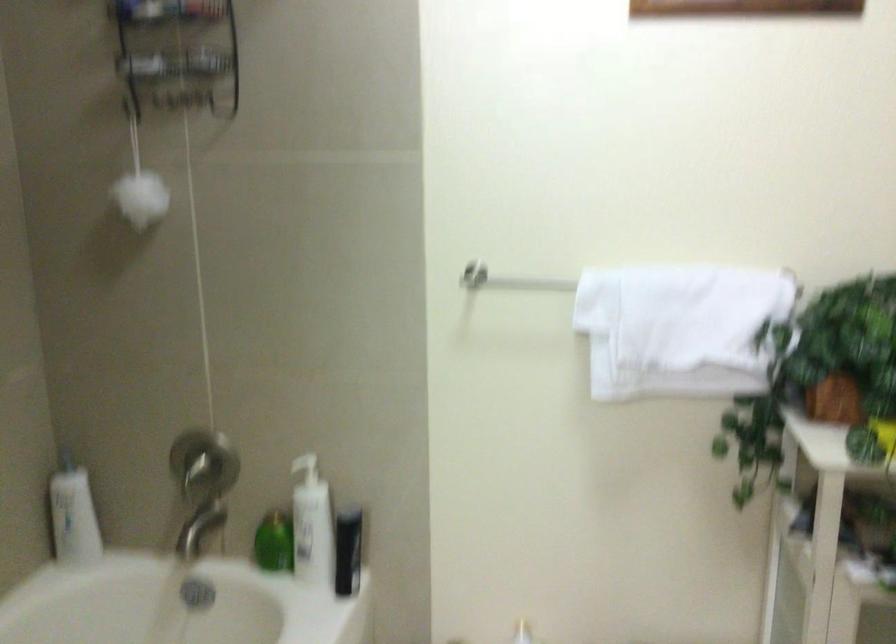
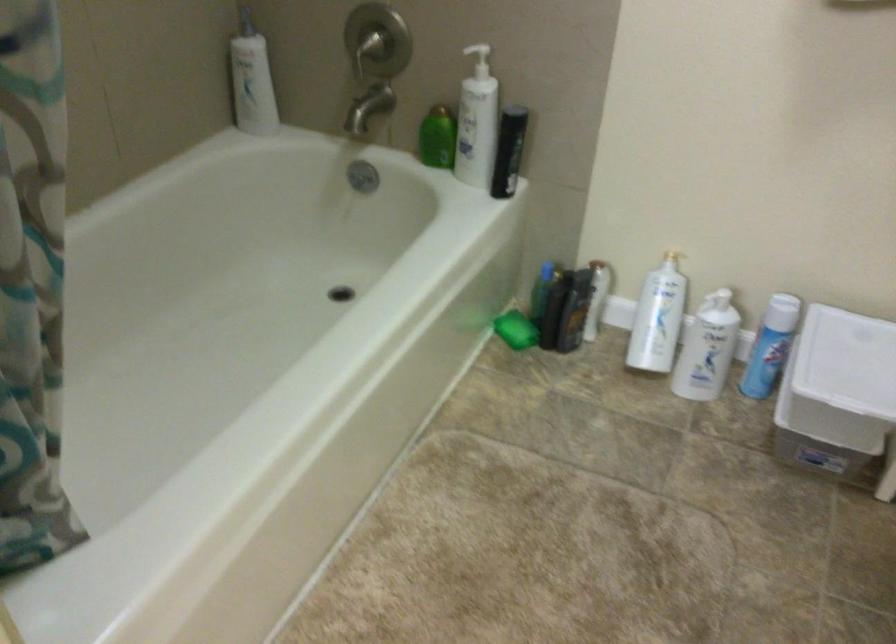
The point at (277, 545) is marked in the first image. Where is the corresponding point in the second image?

(437, 138)